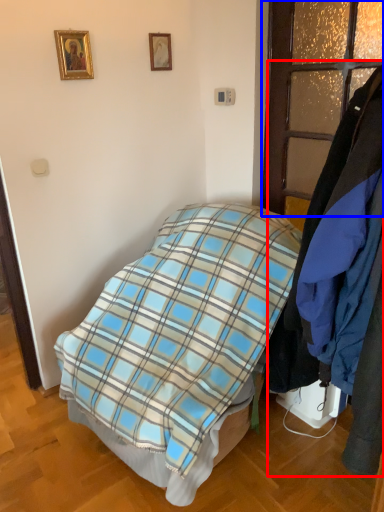
Question: Which point is closer to the camera, closet (highlighted by a red box) or glass door (highlighted by a blue box)?

Choices:
 (A) closet
 (B) glass door

Answer: (A)